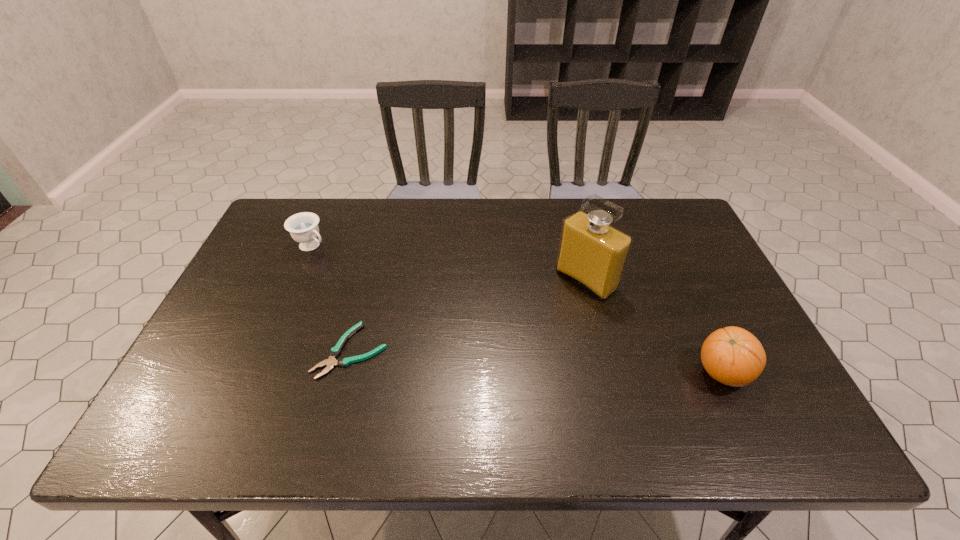
Locate an element on the screen. The width and height of the screenshot is (960, 540). free space on the desktop that is between the third object from right to left and the second tallest object and is positioned on the side of the second shortest object with the handle is located at coordinates (488, 359).

Find the location of a particular element. vacant space on the desktop that is between the pliers and the orange and is positioned on the front-facing side of the third object from left to right is located at coordinates (486, 359).